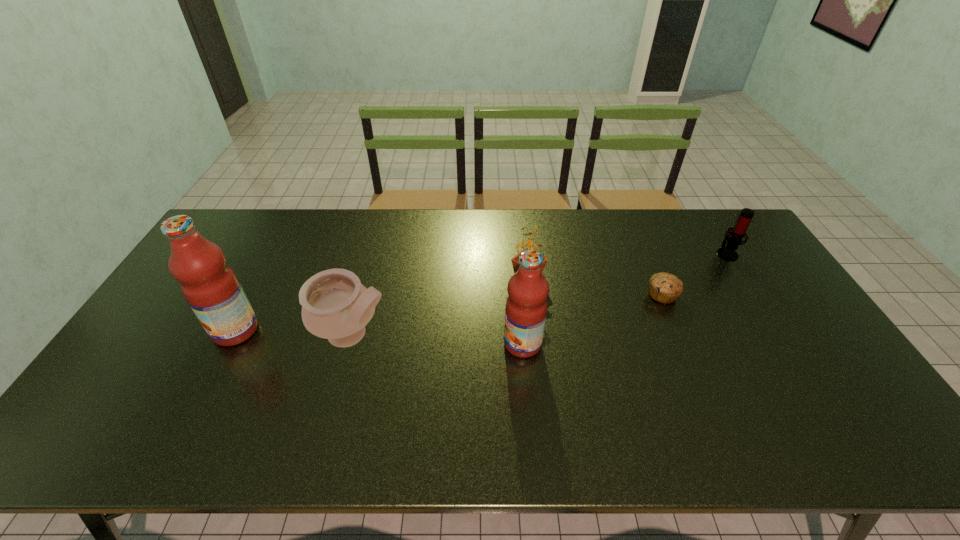
Please point a spot on the right to add another fruit juice. Please provide its 2D coordinates. Your answer should be formatted as a tuple, i.e. [(x, y)], where the tuple contains the x and y coordinates of a point satisfying the conditions above.

[(827, 358)]